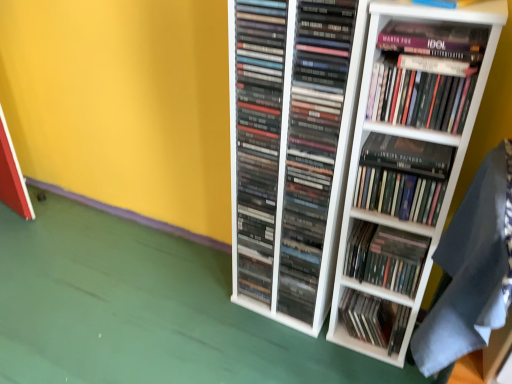
Question: Based on their sizes in the image, would you say matte black books at center, acting as the 3th book starting from the bottom, is bigger or smaller than dark gray fabric at lower right?

Choices:
 (A) big
 (B) small

Answer: (B)

Question: From their relative heights in the image, would you say matte black books at center, acting as the 3th book starting from the bottom, is taller or shorter than dark gray fabric at lower right?

Choices:
 (A) short
 (B) tall

Answer: (B)

Question: Which object is the closest to the matte black book at center, which appears as the 7th book when viewed from the top?

Choices:
 (A) matte black cds at center, which is the third book from top to bottom
 (B) matte purple paperback book at upper right
 (C) black matte book at upper right, which appears as the 6th book when ordered from the bottom
 (D) dark gray fabric at lower right
 (E) white matte bookshelf at center

Answer: (E)

Question: Based on their relative distances, which object is nearer to the matte purple paperback book at upper right?

Choices:
 (A) matte black books at center, which appears as the fifth book when viewed from the top
 (B) matte black books at center, the sixth book when ordered from top to bottom
 (C) hardcover books at center, positioned as the fourth book in top-to-bottom order
 (D) white matte bookshelf at center
 (E) dark gray fabric at lower right

Answer: (A)